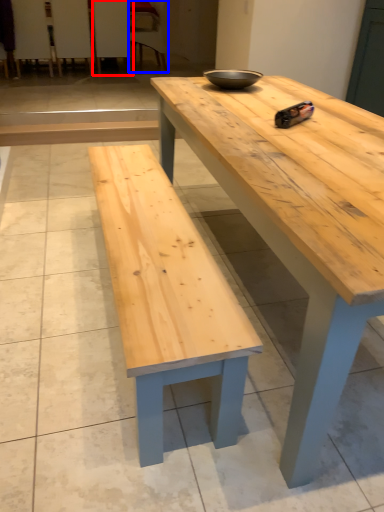
Question: Among these objects, which one is farthest to the camera, chair (highlighted by a red box) or chair (highlighted by a blue box)?

Choices:
 (A) chair
 (B) chair

Answer: (B)